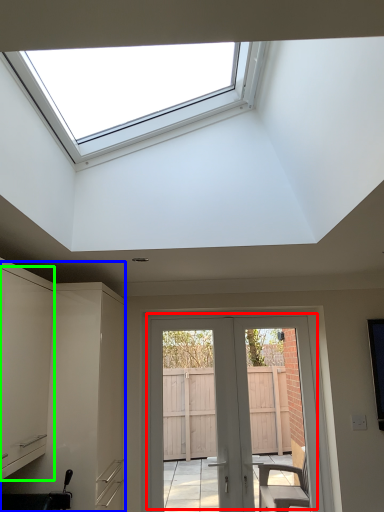
Question: Considering the real-world distances, which object is closest to door (highlighted by a red box)? cabinetry (highlighted by a blue box) or cabinetry (highlighted by a green box).

Choices:
 (A) cabinetry
 (B) cabinetry

Answer: (A)